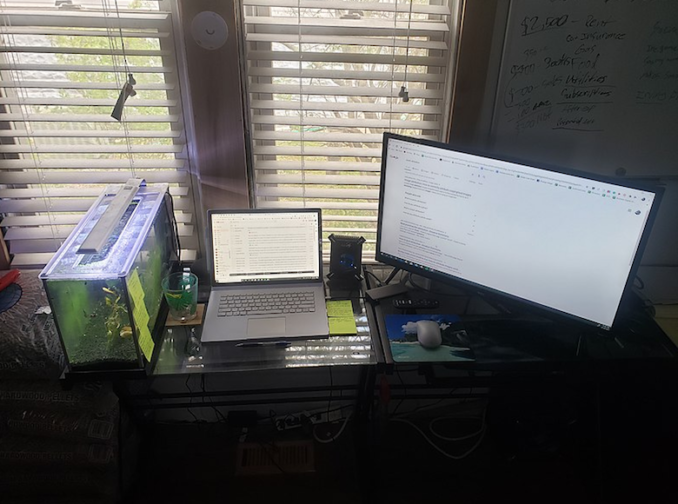
You are a GUI agent. You are given a task and a screenshot of the screen. Output one action in this format:
    pyautogui.click(x=<x>, y=<y>)
    Task: Click on the window
    
    Given the screenshot: What is the action you would take?
    pyautogui.click(x=337, y=98), pyautogui.click(x=66, y=106)